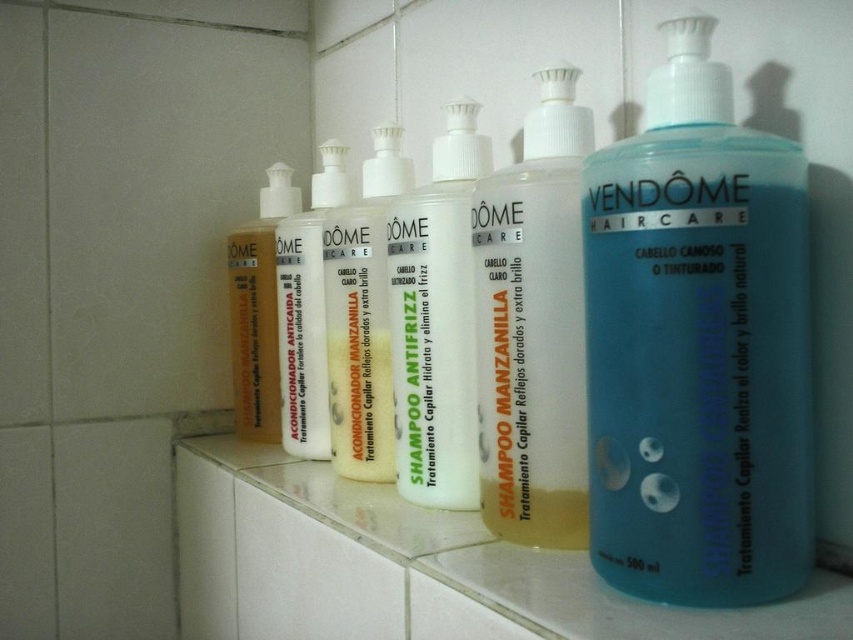
Can you confirm if blue translucent shampoo at center is wider than clear glass counter top at center?

In fact, blue translucent shampoo at center might be narrower than clear glass counter top at center.

Can you confirm if blue translucent shampoo at center is positioned below clear glass counter top at center?

Actually, blue translucent shampoo at center is above clear glass counter top at center.

The image size is (853, 640). I want to click on blue translucent shampoo at center, so click(x=698, y=346).

Between clear glass counter top at center and white opaque plastic shampoo bottle at center, which one appears on the right side from the viewer's perspective?

white opaque plastic shampoo bottle at center

Between clear glass counter top at center and white opaque plastic shampoo bottle at center, which one is positioned higher?

white opaque plastic shampoo bottle at center is higher up.

Describe the element at coordinates (407, 566) in the screenshot. I see `clear glass counter top at center` at that location.

I want to click on clear glass counter top at center, so click(x=407, y=566).

Does blue translucent shampoo at center appear on the right side of translucent plastic shampoo at center?

Indeed, blue translucent shampoo at center is positioned on the right side of translucent plastic shampoo at center.

Does point (677, 589) come behind point (526, 355)?

No, it is not.

Locate an element on the screen. Image resolution: width=853 pixels, height=640 pixels. blue translucent shampoo at center is located at coordinates (698, 346).